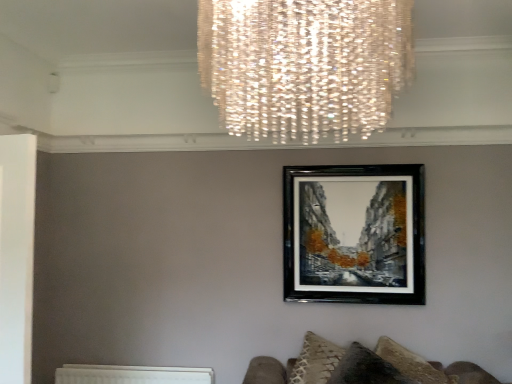
Question: Is white textured radiator at lower left far away from black glossy picture frame at center?

Choices:
 (A) no
 (B) yes

Answer: (B)

Question: Can you confirm if white textured radiator at lower left is shorter than black glossy picture frame at center?

Choices:
 (A) no
 (B) yes

Answer: (B)

Question: Is white textured radiator at lower left thinner than black glossy picture frame at center?

Choices:
 (A) yes
 (B) no

Answer: (B)

Question: Is white textured radiator at lower left turned away from black glossy picture frame at center?

Choices:
 (A) yes
 (B) no

Answer: (B)

Question: Does white textured radiator at lower left appear on the left side of black glossy picture frame at center?

Choices:
 (A) yes
 (B) no

Answer: (A)

Question: In the image, is black glossy picture frame at center positioned in front of or behind velvet textured cushion at lower right?

Choices:
 (A) front
 (B) behind

Answer: (B)

Question: Considering the positions of black glossy picture frame at center and velvet textured cushion at lower right in the image, is black glossy picture frame at center wider or thinner than velvet textured cushion at lower right?

Choices:
 (A) wide
 (B) thin

Answer: (B)

Question: From the image's perspective, is black glossy picture frame at center located above or below velvet textured cushion at lower right?

Choices:
 (A) below
 (B) above

Answer: (B)

Question: Do you think black glossy picture frame at center is within velvet textured cushion at lower right, or outside of it?

Choices:
 (A) inside
 (B) outside

Answer: (B)

Question: Is white textured radiator at lower left spatially inside black glossy picture frame at center, or outside of it?

Choices:
 (A) outside
 (B) inside

Answer: (A)

Question: Is white textured radiator at lower left in front of or behind black glossy picture frame at center in the image?

Choices:
 (A) behind
 (B) front

Answer: (A)

Question: From a real-world perspective, is white textured radiator at lower left physically located above or below black glossy picture frame at center?

Choices:
 (A) above
 (B) below

Answer: (B)

Question: Does point (164, 375) appear closer or farther from the camera than point (422, 240)?

Choices:
 (A) farther
 (B) closer

Answer: (A)

Question: Considering their positions, is velvet textured cushion at lower right located in front of or behind black glossy picture frame at center?

Choices:
 (A) front
 (B) behind

Answer: (A)

Question: From a real-world perspective, relative to black glossy picture frame at center, is velvet textured cushion at lower right vertically above or below?

Choices:
 (A) above
 (B) below

Answer: (B)